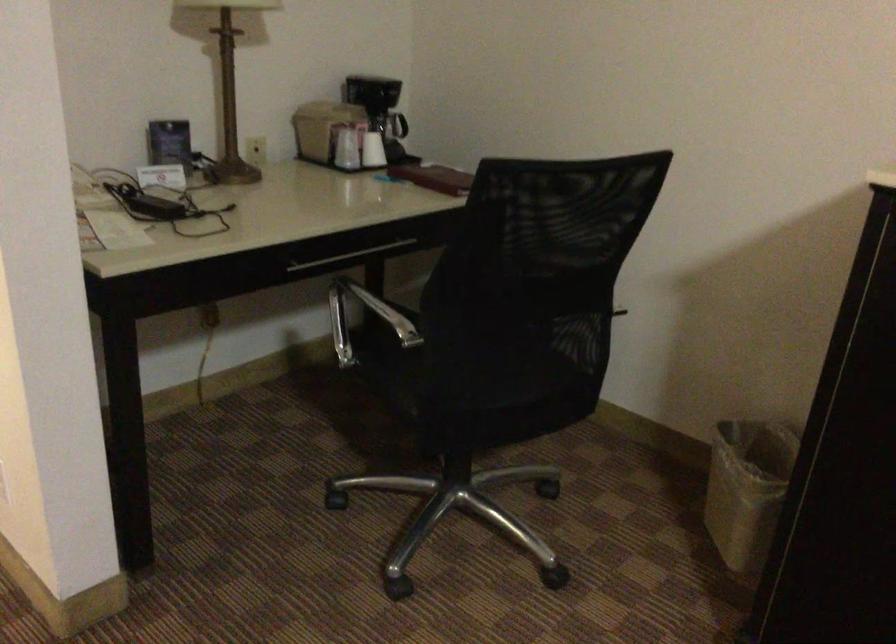
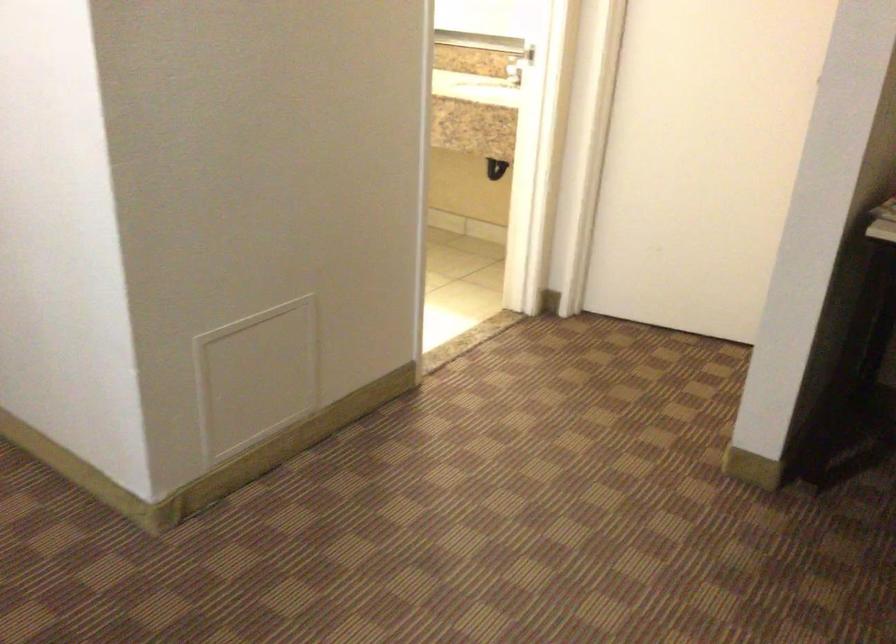
Question: The camera is either moving clockwise (left) or counter-clockwise (right) around the object. The first image is from the beginning of the video and the second image is from the end. Is the camera moving left or right when shooting the video?

Choices:
 (A) Left
 (B) Right

Answer: (B)